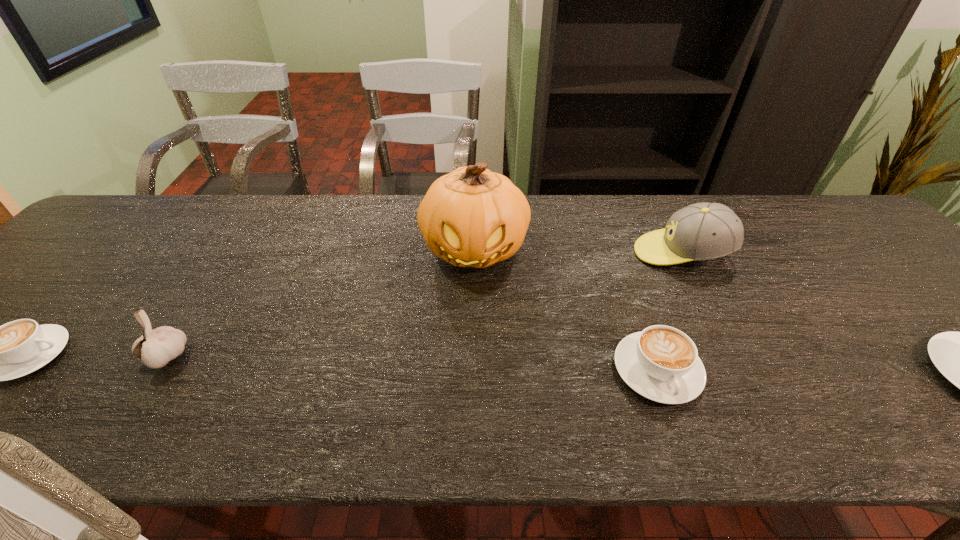
Where is `vacant point at the far left corner`? The image size is (960, 540). vacant point at the far left corner is located at coordinates (176, 201).

At what (x,y) coordinates should I click in order to perform the action: click on empty space that is in between the fifth object from right to left and the pumpkin. Please return your answer as a coordinate pair (x, y). Looking at the image, I should click on (321, 303).

The width and height of the screenshot is (960, 540). What are the coordinates of `free area in between the baseball cap and the second shortest cappuccino` in the screenshot? It's located at (670, 312).

Locate an element on the screen. Image resolution: width=960 pixels, height=540 pixels. free point between the third object from left to right and the second cappuccino from right to left is located at coordinates (566, 309).

This screenshot has width=960, height=540. I want to click on free area in between the garlic and the second tallest cappuccino, so click(412, 363).

This screenshot has width=960, height=540. Find the location of `unoccupied area between the fifth shortest object and the tallest object`. unoccupied area between the fifth shortest object and the tallest object is located at coordinates (579, 251).

This screenshot has height=540, width=960. In order to click on object that is the third closest to the shortest object in this screenshot , I will do `click(661, 363)`.

Identify which object is the third closest to the fifth tallest object. Please provide its 2D coordinates. Your answer should be formatted as a tuple, i.e. [(x, y)], where the tuple contains the x and y coordinates of a point satisfying the conditions above.

[(959, 356)]

Identify which cappuccino is the second closest to the third object from left to right. Please provide its 2D coordinates. Your answer should be formatted as a tuple, i.e. [(x, y)], where the tuple contains the x and y coordinates of a point satisfying the conditions above.

[(0, 353)]

Identify the location of cappuccino that is the second closest to the second shortest object. (0, 353).